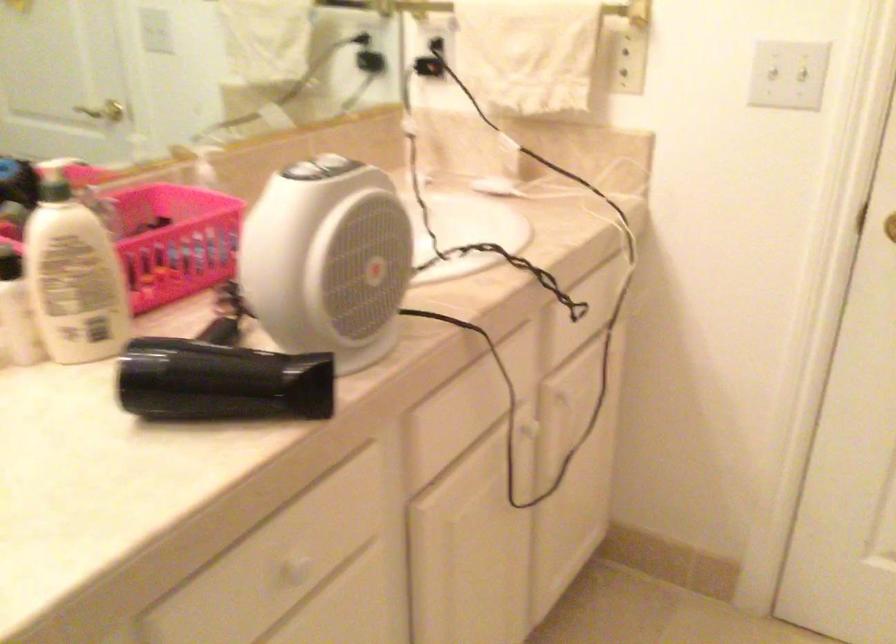
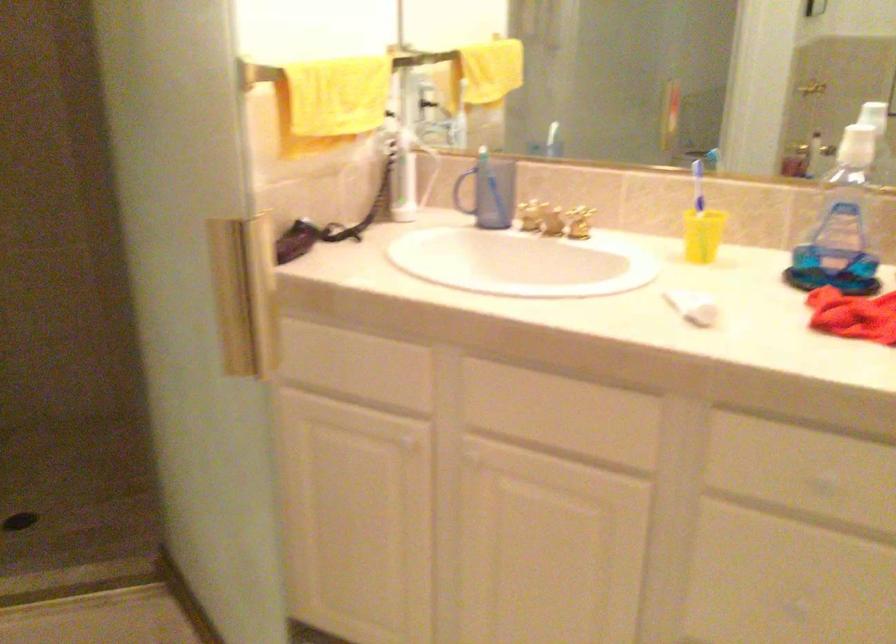
First-person continuous shooting, in which direction is the camera rotating?

The camera's rotation is toward left-down.